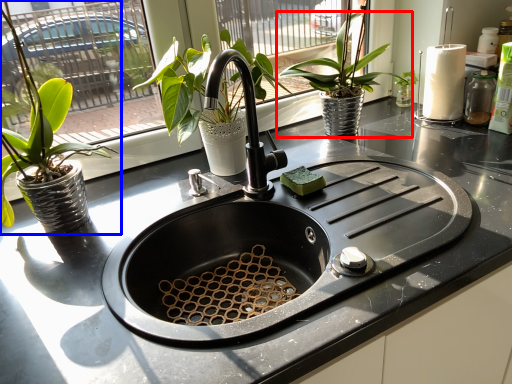
Question: Which object is closer to the camera taking this photo, houseplant (highlighted by a red box) or houseplant (highlighted by a blue box)?

Choices:
 (A) houseplant
 (B) houseplant

Answer: (B)